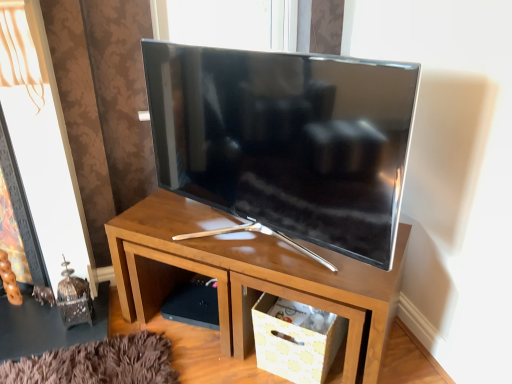
Question: Is white paper storage box at lower right bigger or smaller than wooden tv stand at center?

Choices:
 (A) small
 (B) big

Answer: (A)

Question: Is white paper storage box at lower right inside the boundaries of wooden tv stand at center, or outside?

Choices:
 (A) outside
 (B) inside

Answer: (B)

Question: Which object is the closest to the satin black tv at center?

Choices:
 (A) wooden tv stand at center
 (B) white paper storage box at lower right

Answer: (A)

Question: Which is nearer to the white paper storage box at lower right?

Choices:
 (A) satin black tv at center
 (B) wooden tv stand at center

Answer: (B)